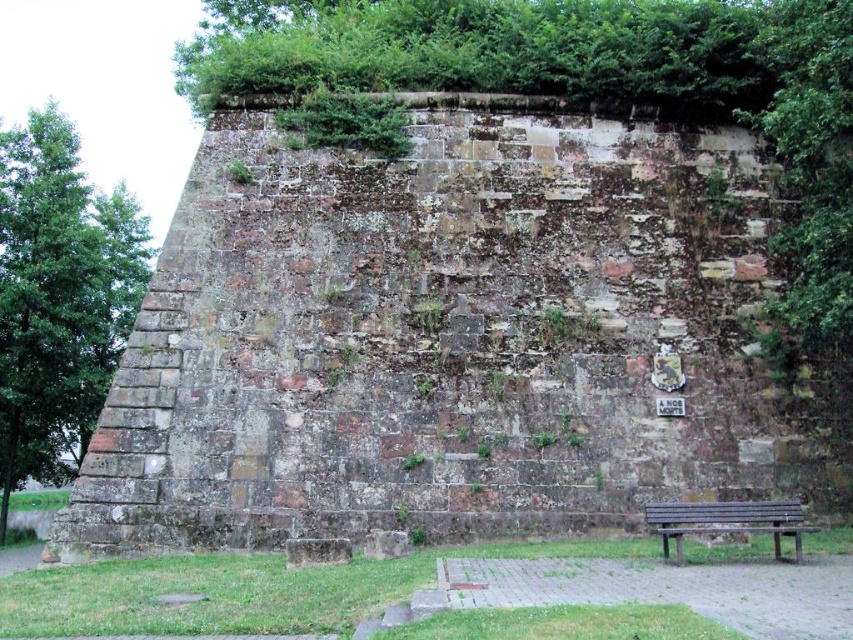
Question: Is brown stone wall at center above green leafy tree at left?

Choices:
 (A) no
 (B) yes

Answer: (A)

Question: Which object is farther from the camera taking this photo?

Choices:
 (A) brown wooden bench at lower right
 (B) green leafy tree at left
 (C) brown stone wall at center

Answer: (B)

Question: Among these points, which one is farthest from the camera?

Choices:
 (A) (97, 317)
 (B) (146, 513)

Answer: (A)

Question: Which point is closer to the camera?

Choices:
 (A) brown stone wall at center
 (B) green leafy tree at left

Answer: (A)

Question: Can you confirm if green leafy tree at left is wider than brown wooden bench at lower right?

Choices:
 (A) no
 (B) yes

Answer: (B)

Question: Does green leafy tree at left appear on the right side of brown wooden bench at lower right?

Choices:
 (A) yes
 (B) no

Answer: (B)